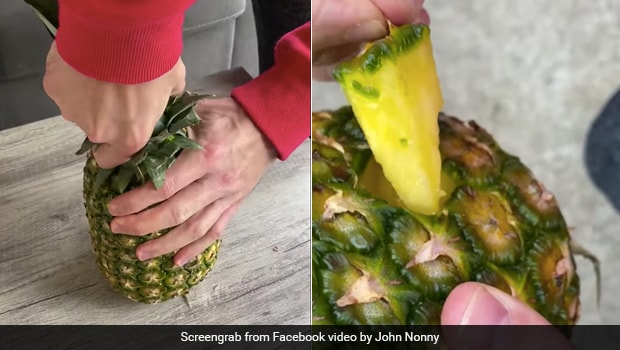
Find the location of a particular element. floor is located at coordinates (523, 27), (547, 93).